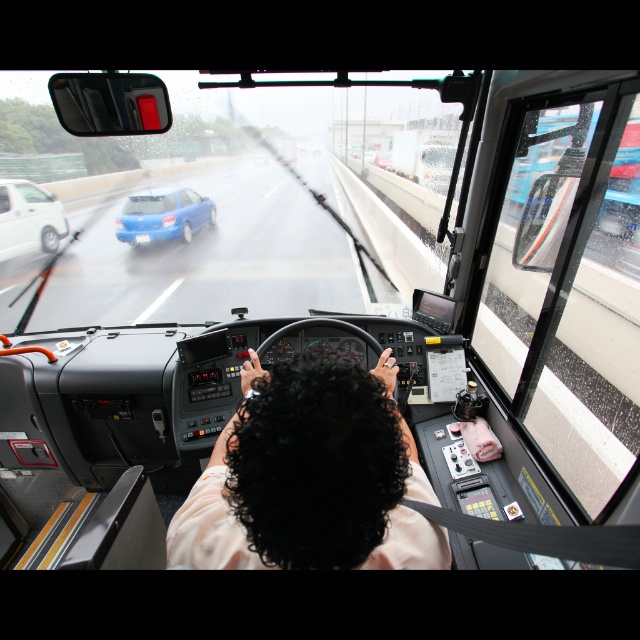
Does point (170, 150) come closer to viewer compared to point (310, 356)?

No, (170, 150) is further to viewer.

Is transparent glass windshield at center above dark curly hair at center?

Yes.

Is point (333, 97) more distant than point (337, 433)?

Yes, point (333, 97) is behind point (337, 433).

Image resolution: width=640 pixels, height=640 pixels. I want to click on transparent glass windshield at center, so click(x=246, y=202).

Measure the distance between point (141, 212) and camera.

10.60 meters

What do you see at coordinates (163, 216) in the screenshot? The height and width of the screenshot is (640, 640). I see `matte blue car at left` at bounding box center [163, 216].

Where is `matte blue car at left`? This screenshot has width=640, height=640. matte blue car at left is located at coordinates (163, 216).

This screenshot has height=640, width=640. In order to click on matte blue car at left in this screenshot , I will do `click(163, 216)`.

Between transparent glass windshield at center and white matte sedan at left, which one appears on the right side from the viewer's perspective?

transparent glass windshield at center is more to the right.

Consider the image. Measure the distance between transparent glass windshield at center and white matte sedan at left.

transparent glass windshield at center is 18.57 meters away from white matte sedan at left.

Is point (4, 308) farther from viewer compared to point (26, 186)?

No, (4, 308) is in front of (26, 186).

I want to click on transparent glass windshield at center, so (246, 202).